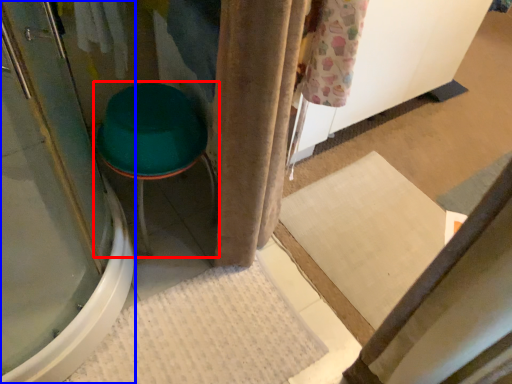
Question: Among these objects, which one is nearest to the camera, furniture (highlighted by a red box) or screen door (highlighted by a blue box)?

Choices:
 (A) furniture
 (B) screen door

Answer: (B)